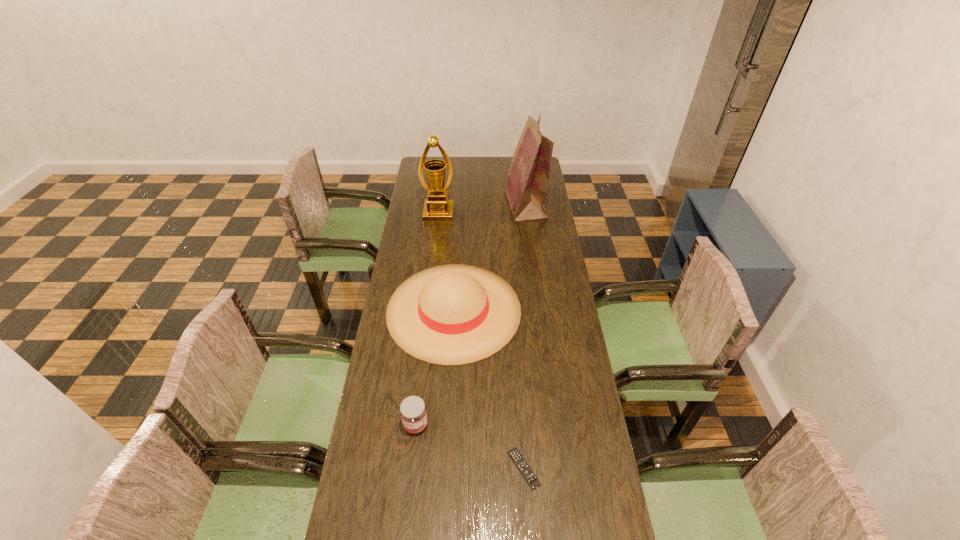
At what (x,y) coordinates should I click in order to perform the action: click on vacant space located on the front-facing side of the grocery bag. Please return your answer as a coordinate pair (x, y). Looking at the image, I should click on (495, 204).

In order to click on vacant space located 0.370m on the front-facing side of the award in this screenshot , I will do `click(432, 274)`.

Locate an element on the screen. The height and width of the screenshot is (540, 960). vacant space located on the front of the sombrero is located at coordinates (449, 393).

Where is `free location located on the left of the jam`? Image resolution: width=960 pixels, height=540 pixels. free location located on the left of the jam is located at coordinates (372, 425).

Where is `vacant space located 0.230m on the left of the nearest object`? The image size is (960, 540). vacant space located 0.230m on the left of the nearest object is located at coordinates (430, 469).

Find the location of a particular element. This screenshot has height=540, width=960. award that is at the left edge is located at coordinates (437, 208).

The image size is (960, 540). I want to click on sombrero that is at the left edge, so click(454, 314).

At what (x,y) coordinates should I click in order to perform the action: click on jam located in the left edge section of the desktop. Please return your answer as a coordinate pair (x, y). The width and height of the screenshot is (960, 540). Looking at the image, I should click on (413, 412).

Find the location of `object that is positioned at the right edge`. object that is positioned at the right edge is located at coordinates (526, 185).

In the image, there is a desktop. Where is `blank space at the far edge`? blank space at the far edge is located at coordinates (499, 168).